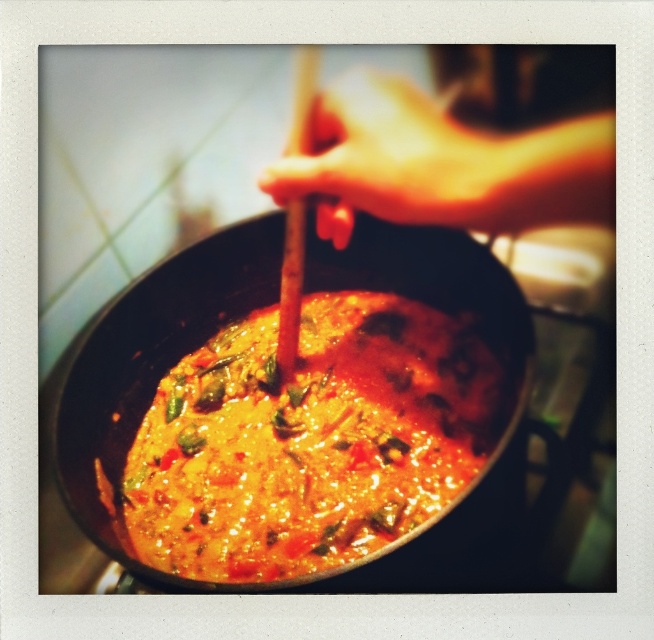
Question: Does yellow-orange sauce at center lie behind smooth wooden spoon at center?

Choices:
 (A) no
 (B) yes

Answer: (B)

Question: Among these objects, which one is farthest from the camera?

Choices:
 (A) smooth wooden spoon at center
 (B) yellow-orange sauce at center

Answer: (B)

Question: Which point is farther to the camera?

Choices:
 (A) (271, 540)
 (B) (400, 208)

Answer: (A)

Question: Can you confirm if yellow-orange sauce at center is wider than smooth wooden spoon at center?

Choices:
 (A) no
 (B) yes

Answer: (B)

Question: Which point is farther to the camera?

Choices:
 (A) (432, 444)
 (B) (432, 204)

Answer: (A)

Question: In this image, where is yellow-orange sauce at center located relative to smooth wooden spoon at center?

Choices:
 (A) below
 (B) above

Answer: (A)